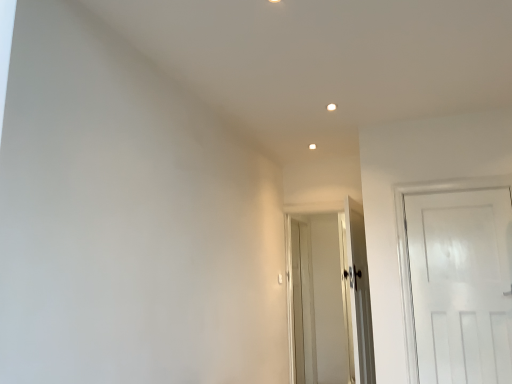
Question: Considering the positions of white glossy door at center, which is the second door from front to back, and white wooden door at center, arranged as the third door when viewed from the front, in the image, is white glossy door at center, which is the second door from front to back, bigger or smaller than white wooden door at center, arranged as the third door when viewed from the front,?

Choices:
 (A) big
 (B) small

Answer: (B)

Question: Looking at their shapes, would you say white glossy door at center, the second door in the back-to-front sequence, is wider or thinner than white wooden door at center, which appears as the 1th door when viewed from the back?

Choices:
 (A) wide
 (B) thin

Answer: (B)

Question: Which of these objects is positioned farthest from the white wooden door at center, which appears as the 1th door when viewed from the back?

Choices:
 (A) white glossy door at center, which is the second door from front to back
 (B) white matte door at right, the first door when ordered from front to back

Answer: (B)

Question: Which is nearer to the white glossy door at center, which is the second door from front to back?

Choices:
 (A) white wooden door at center, which appears as the 1th door when viewed from the back
 (B) white matte door at right, which is counted as the 3th door, starting from the back

Answer: (B)